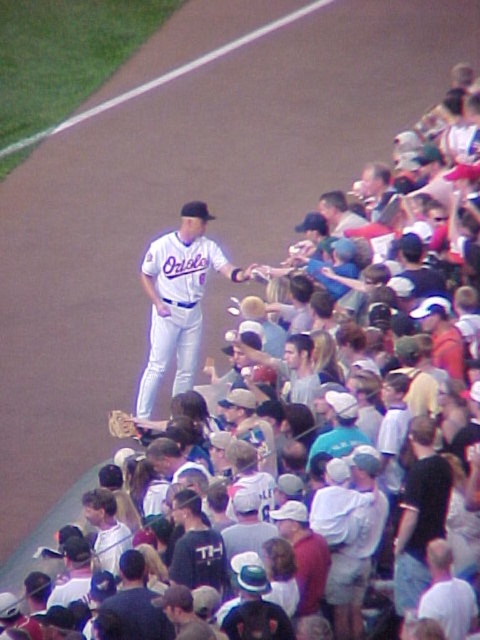
Question: Does white matte baseball uniform at center appear over white jersey at center?

Choices:
 (A) no
 (B) yes

Answer: (B)

Question: Which of these objects is positioned closest to the black cotton shirt at center?

Choices:
 (A) white jersey at center
 (B) white matte baseball uniform at center

Answer: (A)

Question: From the image, what is the correct spatial relationship of black cotton shirt at center in relation to brown leather glove at center?

Choices:
 (A) below
 (B) above

Answer: (A)

Question: Does black cotton shirt at center have a greater width compared to white jersey at center?

Choices:
 (A) yes
 (B) no

Answer: (B)

Question: Which object is closer to the camera taking this photo?

Choices:
 (A) white jersey at center
 (B) white matte baseball uniform at center
 (C) black cotton shirt at center
 (D) white cotton shirt at center

Answer: (D)

Question: Considering the real-world distances, which object is farthest from the white jersey at center?

Choices:
 (A) white cotton shirt at center
 (B) black cotton shirt at center

Answer: (B)